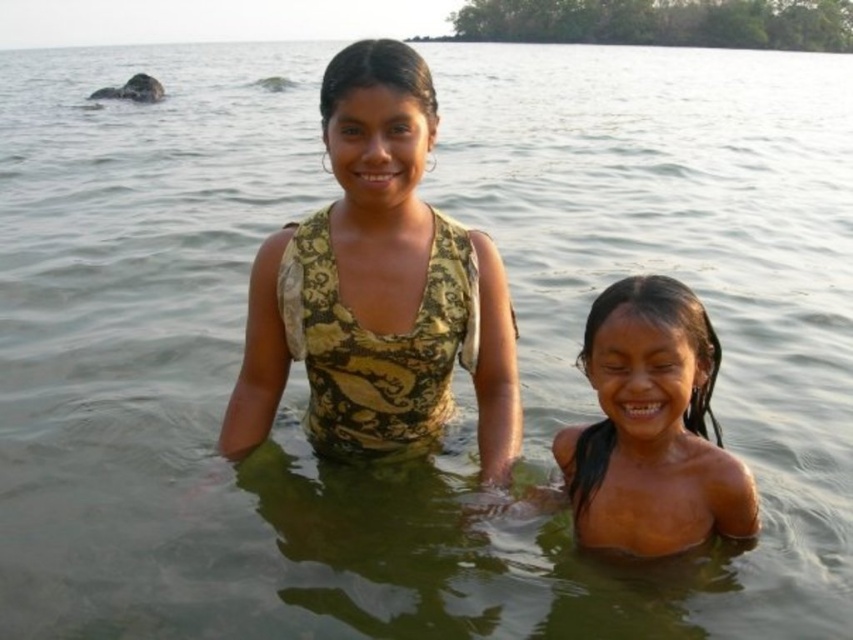
You are trying to determine the position of the two people in the image. According to the description, where is the camouflage fabric top at center in relation to the dry skin at center?

The camouflage fabric top at center is to the left of dry skin at center.

You are a photographer trying to capture the camouflage fabric top at center in the image. Given that the point at coordinates (378, 288) is where the top is located, can you estimate its position relative to the two people in the scene?

The camouflage fabric top at center is located at point (378, 288), which is between the two individuals standing in the water. Since the person on the left is wearing a sleeveless top with patterned design and the one on the right is shirtless, the camouflage fabric top at center is likely placed centrally between them.